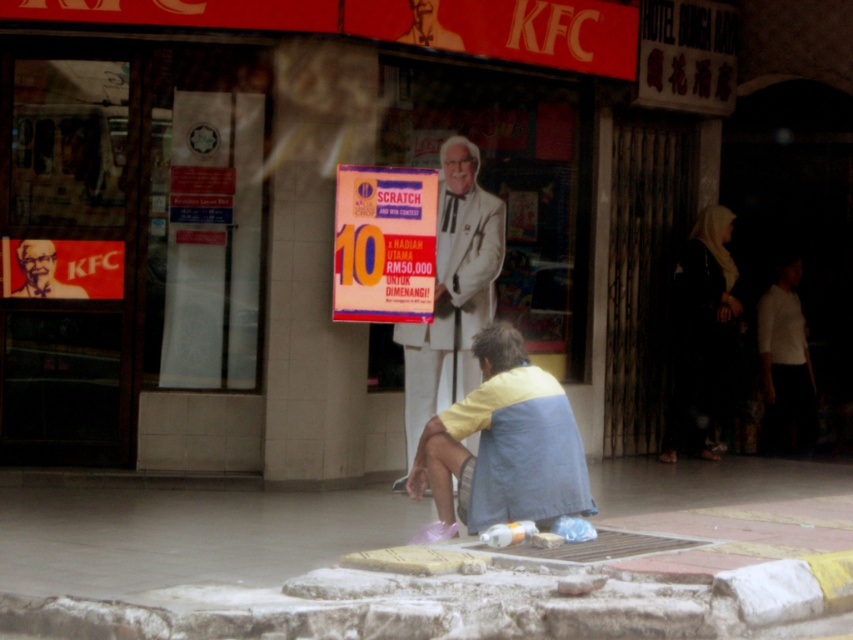
Based on the photo, who is higher up, concrete at lower center or yellow fabric at lower center?

yellow fabric at lower center is above.

Can you confirm if concrete at lower center is positioned above yellow fabric at lower center?

Actually, concrete at lower center is below yellow fabric at lower center.

You are a GUI agent. You are given a task and a screenshot of the screen. Output one action in this format:
    pyautogui.click(x=<x>, y=<y>)
    Task: Click on the concrete at lower center
    The width and height of the screenshot is (853, 640).
    Given the screenshot: What is the action you would take?
    pyautogui.click(x=186, y=534)

Does yellow fabric at lower center come behind white suit at center?

That is False.

Is yellow fabric at lower center above white suit at center?

Actually, yellow fabric at lower center is below white suit at center.

Is point (560, 406) farther from camera compared to point (486, 193)?

No, it is not.

Locate an element on the screen. Image resolution: width=853 pixels, height=640 pixels. yellow fabric at lower center is located at coordinates (503, 444).

Does concrete at lower center have a greater height compared to white suit at center?

No, concrete at lower center is not taller than white suit at center.

Is point (82, 556) more distant than point (442, 148)?

No, (82, 556) is in front of (442, 148).

Describe the element at coordinates (186, 534) in the screenshot. I see `concrete at lower center` at that location.

Where is `concrete at lower center`? concrete at lower center is located at coordinates (186, 534).